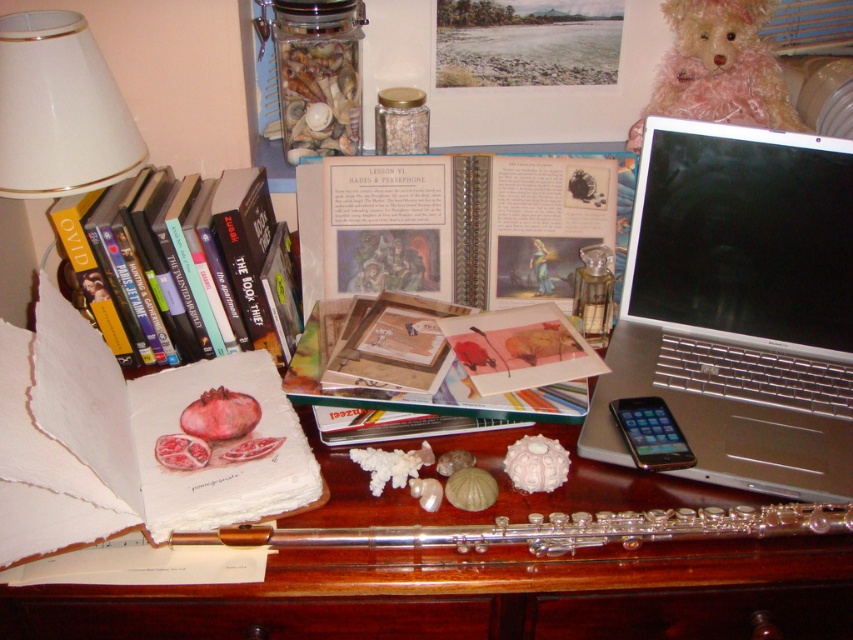
Is silver metallic laptop at right closer to camera compared to fuzzy pink teddy bear at upper right?

That is True.

The width and height of the screenshot is (853, 640). Identify the location of silver metallic laptop at right. (740, 307).

Is hardcover book at left bigger than wooden textured book at center?

Correct, hardcover book at left is larger in size than wooden textured book at center.

Is hardcover book at left to the left of wooden textured book at center from the viewer's perspective?

Correct, you'll find hardcover book at left to the left of wooden textured book at center.

Which is behind, point (195, 230) or point (426, 404)?

The point (195, 230) is more distant.

Identify the location of hardcover book at left. (244, 259).

From the picture: Does fuzzy pink teddy bear at upper right have a larger size compared to wooden textured book at center?

No.

Between point (733, 19) and point (312, 356), which one is positioned in front?

Point (312, 356)

Looking at this image, who is more forward, (689, 116) or (320, 339)?

Point (320, 339) is more forward.

Find the location of a particular element. fuzzy pink teddy bear at upper right is located at coordinates (718, 68).